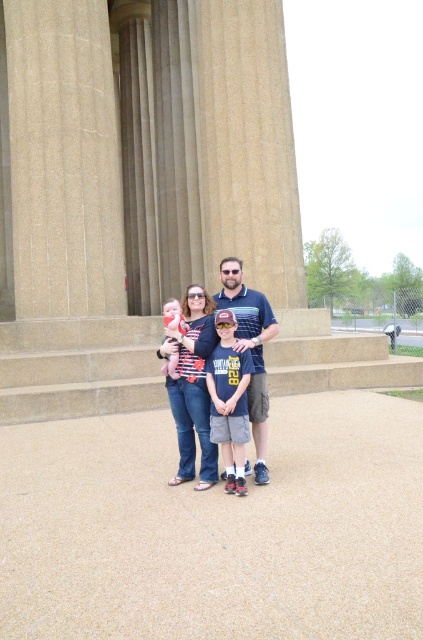
Question: Among these points, which one is nearest to the camera?

Choices:
 (A) (194, 412)
 (B) (255, 291)

Answer: (A)

Question: Which point is closer to the camera?

Choices:
 (A) (260, 340)
 (B) (167, 307)
 (C) (184, 310)

Answer: (A)

Question: Does matte black shirt at center appear on the right side of blue striped polo shirt at center?

Choices:
 (A) yes
 (B) no

Answer: (B)

Question: Considering the relative positions of matte black shirt at center and denim shorts at center in the image provided, where is matte black shirt at center located with respect to denim shorts at center?

Choices:
 (A) left
 (B) right

Answer: (A)

Question: Which point is farther to the camera?

Choices:
 (A) (266, 333)
 (B) (233, 422)
 (C) (216, 476)
 (D) (175, 317)

Answer: (A)

Question: Does matte black shirt at center have a greater width compared to denim shorts at center?

Choices:
 (A) yes
 (B) no

Answer: (A)